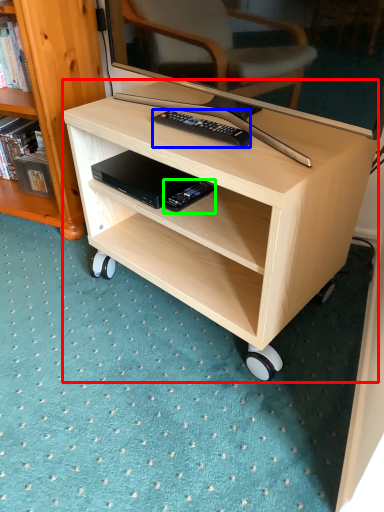
Question: Estimate the real-world distances between objects in this image. Which object is farther from desk (highlighted by a red box), remote control (highlighted by a blue box) or equipment (highlighted by a green box)?

Choices:
 (A) remote control
 (B) equipment

Answer: (B)